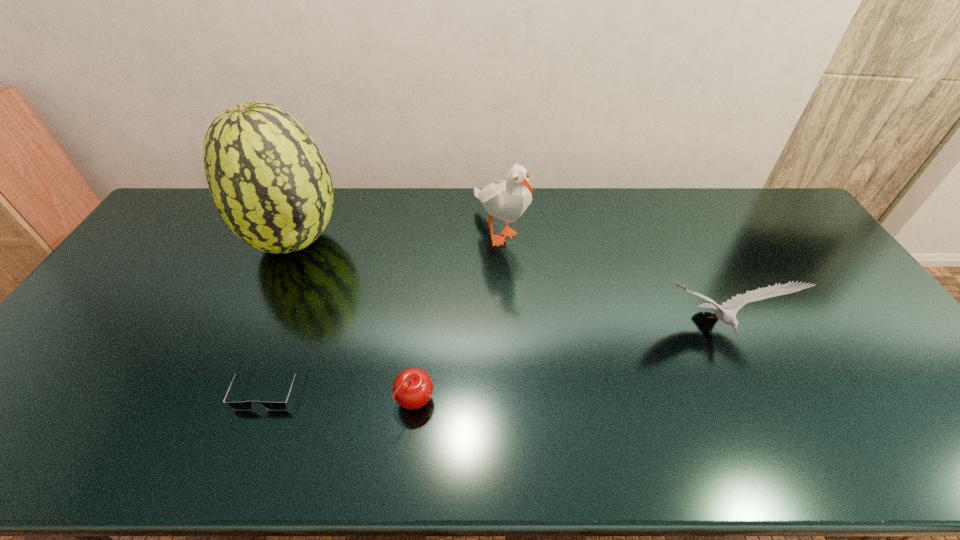
Where is `the tallest object`? This screenshot has width=960, height=540. the tallest object is located at coordinates (269, 181).

At what (x,y) coordinates should I click in order to perform the action: click on the left gull. Please return your answer as a coordinate pair (x, y). Looking at the image, I should click on (507, 200).

The image size is (960, 540). Identify the location of the farther gull. (507, 200).

Identify the location of the rightmost object. The width and height of the screenshot is (960, 540). (728, 316).

Find the location of a particular element. This screenshot has height=540, width=960. the nearer gull is located at coordinates tap(728, 316).

This screenshot has width=960, height=540. I want to click on the second shortest object, so click(x=412, y=389).

At what (x,y) coordinates should I click in order to perform the action: click on cherry. Please return your answer as a coordinate pair (x, y). Looking at the image, I should click on (412, 389).

Locate an element on the screen. This screenshot has width=960, height=540. the shortest object is located at coordinates (239, 406).

Find the location of a particular element. free point located 0.200m on the left of the watermelon is located at coordinates (184, 241).

Locate an element on the screen. The height and width of the screenshot is (540, 960). blank space located at the beak of the farther gull is located at coordinates (502, 276).